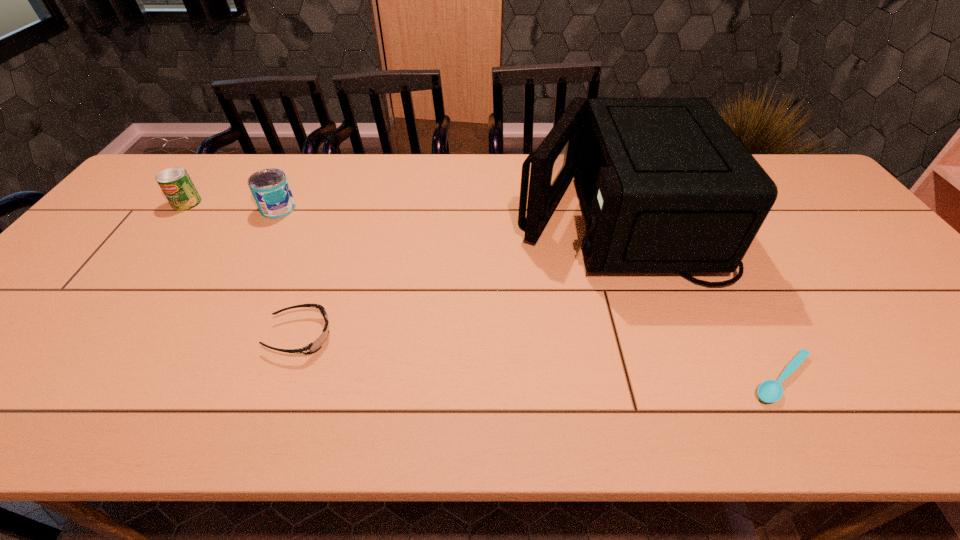
Image resolution: width=960 pixels, height=540 pixels. What are the coordinates of `vacant space in between the microwave oven and the second object from left to right` in the screenshot? It's located at (446, 212).

At what (x,y) coordinates should I click in order to perform the action: click on free point between the right can and the microwave oven. Please return your answer as a coordinate pair (x, y). Looking at the image, I should click on (446, 212).

You are a GUI agent. You are given a task and a screenshot of the screen. Output one action in this format:
    pyautogui.click(x=<x>, y=<y>)
    Task: Click on the vacant region between the fourth tallest object and the spoon
    This screenshot has height=540, width=960.
    Given the screenshot: What is the action you would take?
    (541, 357)

Identify the location of vacant point located between the right can and the left can. (232, 206).

You are a GUI agent. You are given a task and a screenshot of the screen. Output one action in this format:
    pyautogui.click(x=<x>, y=<y>)
    Task: Click on the object that is the second nearest to the second shortest object
    Image resolution: width=960 pixels, height=540 pixels.
    Given the screenshot: What is the action you would take?
    pyautogui.click(x=666, y=186)

Identify the location of the closest object to the shortest object. This screenshot has height=540, width=960. (666, 186).

At what (x,y) coordinates should I click in order to perform the action: click on vacant space that satisfies the following two spatial constraints: 1. on the back side of the shortest object; 2. on the lenses of the third object from left to right. Please return your answer as a coordinate pair (x, y). Looking at the image, I should click on (759, 336).

Image resolution: width=960 pixels, height=540 pixels. Find the location of `blank space that satisfies the following two spatial constraints: 1. with the door open on the spoon; 2. on the right side of the microwave oven`. blank space that satisfies the following two spatial constraints: 1. with the door open on the spoon; 2. on the right side of the microwave oven is located at coordinates (671, 378).

Find the location of `vacant space that satisfies the following two spatial constraints: 1. on the front side of the leftmost object; 2. on the left side of the shortest object`. vacant space that satisfies the following two spatial constraints: 1. on the front side of the leftmost object; 2. on the left side of the shortest object is located at coordinates (53, 378).